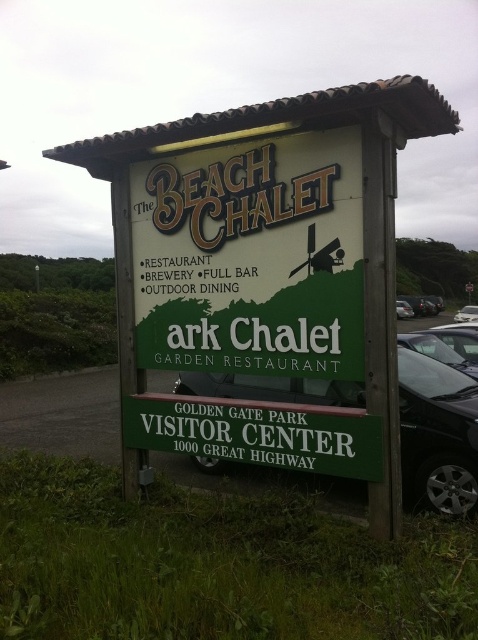
Question: Can you confirm if metallic silver car at center is positioned above silver metallic car at right?

Choices:
 (A) yes
 (B) no

Answer: (B)

Question: Which of the following is the farthest from the observer?

Choices:
 (A) (428, 452)
 (B) (468, 307)
 (C) (401, 317)

Answer: (C)

Question: Is green wooden signboard at center to the right of black glossy car at lower right from the viewer's perspective?

Choices:
 (A) no
 (B) yes

Answer: (B)

Question: Among these points, which one is farthest from the camera?

Choices:
 (A) (415, 342)
 (B) (238, 157)
 (C) (409, 314)
 (D) (459, 321)

Answer: (C)

Question: Is black glossy car at lower right smaller than black glossy car at center?

Choices:
 (A) no
 (B) yes

Answer: (B)

Question: Based on their relative distances, which object is farther from the green matte signboard at center?

Choices:
 (A) silver metallic car at right
 (B) black glossy car at center
 (C) metallic silver car at center
 (D) green wooden signboard at center

Answer: (B)